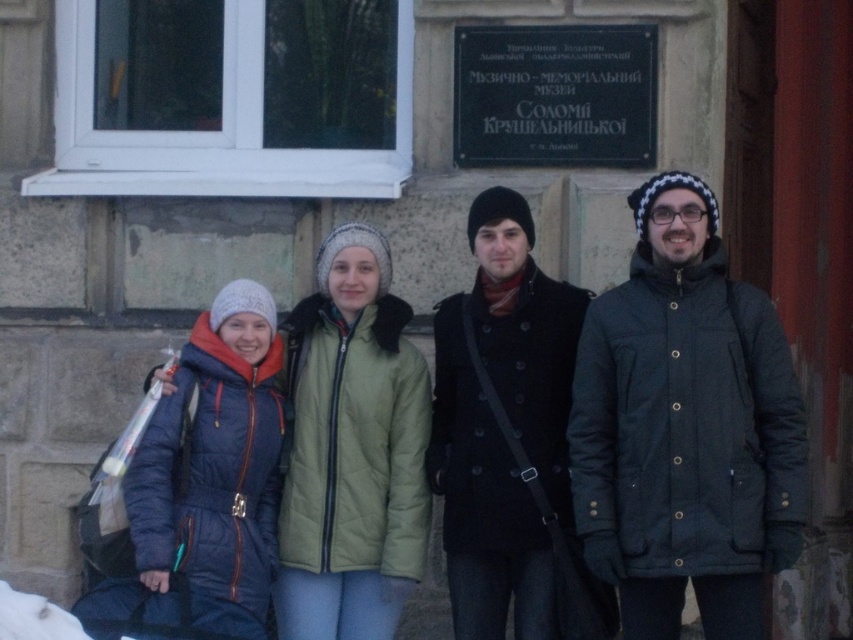
Which of these two, dark gray quilted jacket at center or dark wool coat at center, stands taller?

With more height is dark wool coat at center.

Consider the image. Is dark gray quilted jacket at center below dark wool coat at center?

No.

I want to click on dark gray quilted jacket at center, so click(685, 428).

Measure the distance between dark gray quilted jacket at center and matte blue snowsuit at lower left.

They are 2.39 meters apart.

Does point (668, 628) lie behind point (213, 545)?

That is True.

Who is more forward, (656,376) or (265,628)?

Point (656,376) is in front.

Where is `dark gray quilted jacket at center`? dark gray quilted jacket at center is located at coordinates (685, 428).

Between dark wool coat at center and green quilted jacket at center, which one is positioned higher?

dark wool coat at center is higher up.

Does dark wool coat at center have a lesser height compared to green quilted jacket at center?

In fact, dark wool coat at center may be taller than green quilted jacket at center.

Describe the element at coordinates (503, 428) in the screenshot. I see `dark wool coat at center` at that location.

The width and height of the screenshot is (853, 640). I want to click on dark wool coat at center, so click(503, 428).